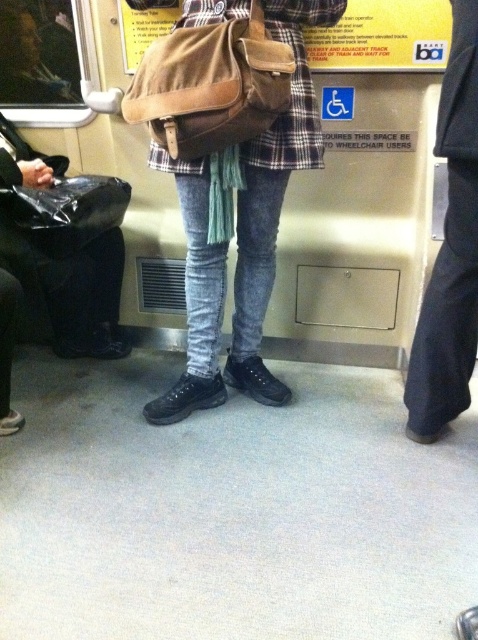
Which of these two, dark blue fabric at right or black plastic bag at left, stands taller?

Standing taller between the two is dark blue fabric at right.

Which is in front, point (462, 188) or point (73, 228)?

Positioned in front is point (462, 188).

This screenshot has height=640, width=478. I want to click on dark blue fabric at right, so click(451, 250).

Does matte brown bag at center have a greater height compared to brown suede bag at center?

Indeed, matte brown bag at center has a greater height compared to brown suede bag at center.

Is matte brown bag at center below brown suede bag at center?

Indeed, matte brown bag at center is positioned under brown suede bag at center.

Is point (231, 332) in front of point (128, 122)?

No, it is behind (128, 122).

Where is `matte brown bag at center`? The height and width of the screenshot is (640, 478). matte brown bag at center is located at coordinates (229, 172).

Is point (86, 333) positioned after point (125, 186)?

Yes, it is behind point (125, 186).

Image resolution: width=478 pixels, height=640 pixels. What do you see at coordinates (65, 244) in the screenshot?
I see `matte black trash can at left` at bounding box center [65, 244].

Between point (93, 192) and point (78, 216), which one is positioned in front?

Point (78, 216)

Locate an element on the screen. The width and height of the screenshot is (478, 640). matte black trash can at left is located at coordinates (65, 244).